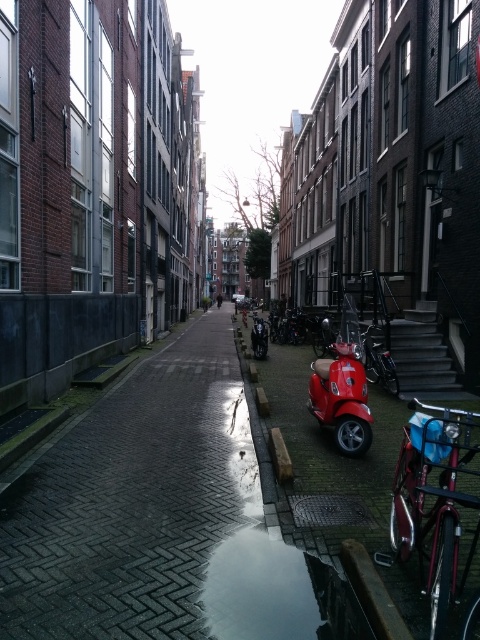
Question: Can you confirm if shiny black motorcycle at center is positioned to the right of metallic silver car at center?

Choices:
 (A) yes
 (B) no

Answer: (A)

Question: Is shiny black bicycle at center to the left of shiny metallic bicycle at center from the viewer's perspective?

Choices:
 (A) yes
 (B) no

Answer: (B)

Question: Is shiny red scooter at center positioned behind shiny black motorcycle at center?

Choices:
 (A) no
 (B) yes

Answer: (A)

Question: Which of the following is the farthest from the observer?

Choices:
 (A) coord(257,340)
 (B) coord(232,300)
 (C) coord(300,630)

Answer: (B)

Question: Estimate the real-world distances between objects in this image. Which object is closer to the metallic silver car at center?

Choices:
 (A) shiny metallic bicycle at center
 (B) brick pavement at center
 (C) shiny red scooter at center
 (D) shiny black motorcycle at center

Answer: (D)

Question: Which point is farther to the camera?

Choices:
 (A) (262, 344)
 (B) (369, 444)

Answer: (A)